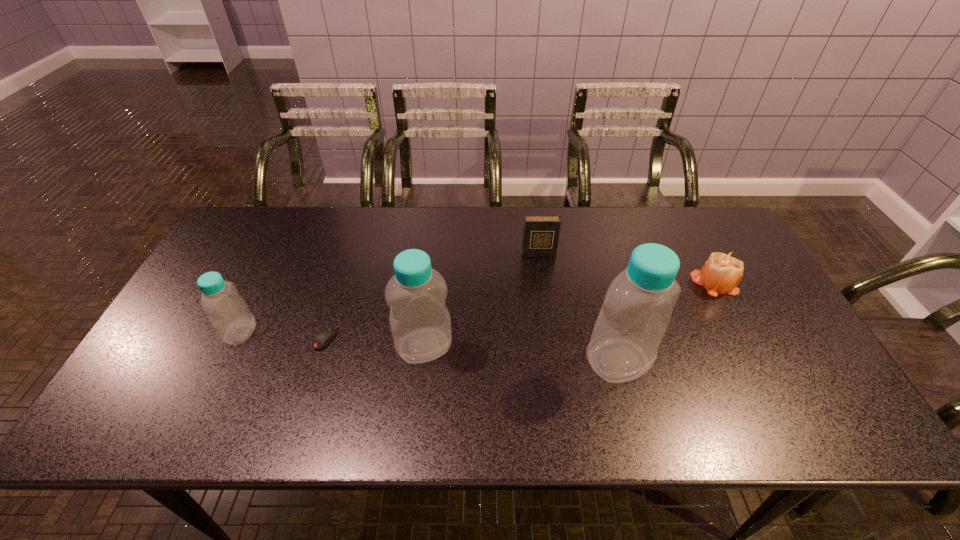
Identify the location of the leftmost bottle. (231, 318).

Identify the location of the leftmost object. This screenshot has width=960, height=540. (231, 318).

Identify the location of the second shortest bottle. The height and width of the screenshot is (540, 960). (420, 323).

Locate an element on the screen. Image resolution: width=960 pixels, height=540 pixels. the second bottle from left to right is located at coordinates (420, 323).

This screenshot has width=960, height=540. Identify the location of the rightmost bottle. (637, 309).

Find the location of a particular element. The image size is (960, 540). diary is located at coordinates (541, 233).

In order to click on the farthest object in this screenshot , I will do `click(541, 233)`.

Locate an element on the screen. Image resolution: width=960 pixels, height=540 pixels. the shortest object is located at coordinates click(x=322, y=339).

Locate an element on the screen. computer mouse is located at coordinates (322, 339).

Identify the location of the rightmost object. This screenshot has height=540, width=960. (722, 272).